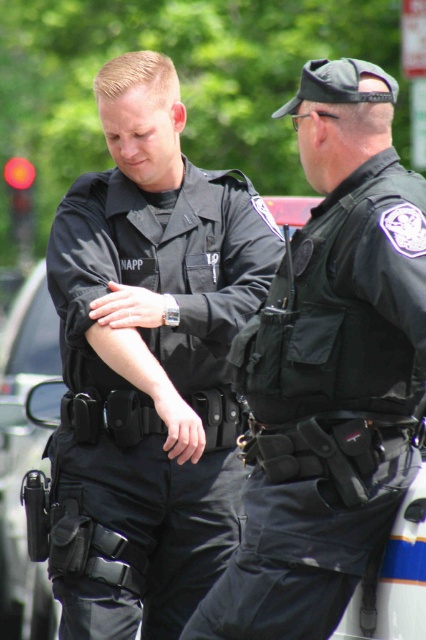
What is the exact coordinate of the black matte uniform at center?

The black matte uniform at center is located at point (152, 388).

You are a third party observer standing in front of the two officers. Which of the two points, point (186, 561) or point (293, 344), is located further away from you?

Point (186, 561) is behind point (293, 344), so it is further away from you.

Consider the image. You are a photographer trying to capture both the black matte uniform at center and the black tactical vest at center in a single shot. Based on their positions, which one should you focus on first to ensure both are in frame?

Since the black matte uniform at center is to the left of the black tactical vest at center, you should focus on the black tactical vest at center first and then pan slightly to the left to include the black matte uniform at center in the frame.